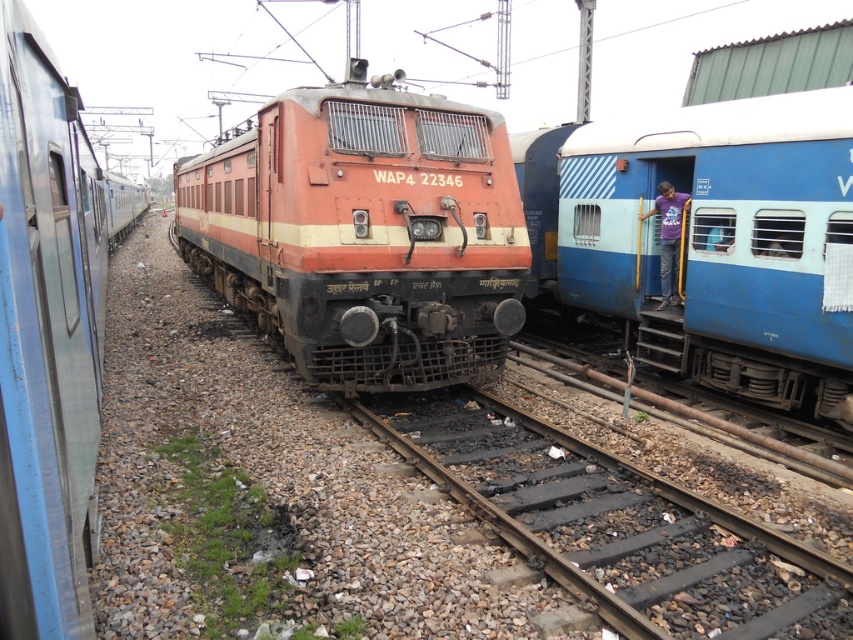
You are standing on the platform and see the blue metallic passenger train at right and the rusty metal train track at center. Which object is positioned to the right side?

The blue metallic passenger train at right is positioned to the right of the rusty metal train track at center.

Based on the scene description, where is the orange matte train at center located in the image?

The orange matte train at center is located at the point coordinates of (364,232) in the image.